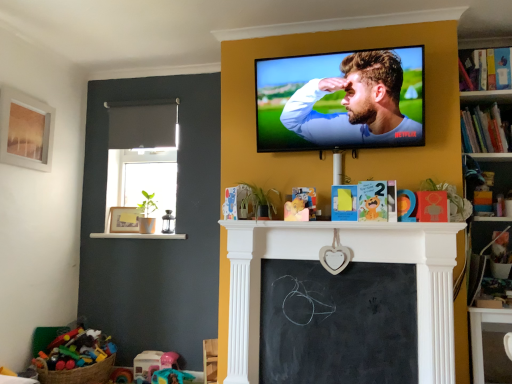
You are a GUI agent. You are given a task and a screenshot of the screen. Output one action in this format:
    pyautogui.click(x=<x>, y=<y>)
    Task: Click on the free point above black fabric curtain at upper left (from a real-world perspective)
    The height and width of the screenshot is (384, 512).
    Given the screenshot: What is the action you would take?
    pyautogui.click(x=136, y=98)